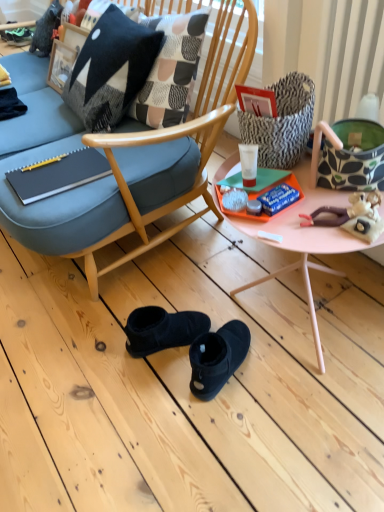
You are a GUI agent. You are given a task and a screenshot of the screen. Output one action in this format:
    pyautogui.click(x=<x>, y=<y>)
    Task: Click on the vacant area that is in front of white glossy cream at center
    This screenshot has height=512, width=384.
    Given the screenshot: What is the action you would take?
    pyautogui.click(x=304, y=229)